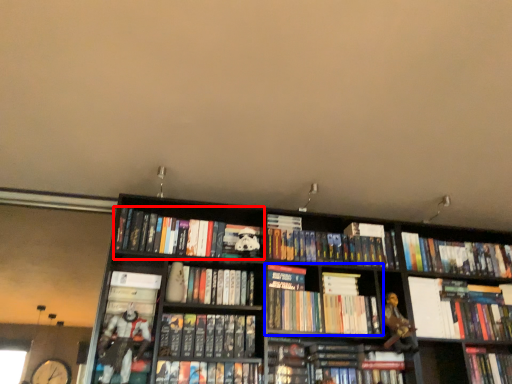
Question: Which of the following is the farthest to the observer, book (highlighted by a red box) or book (highlighted by a blue box)?

Choices:
 (A) book
 (B) book

Answer: (A)